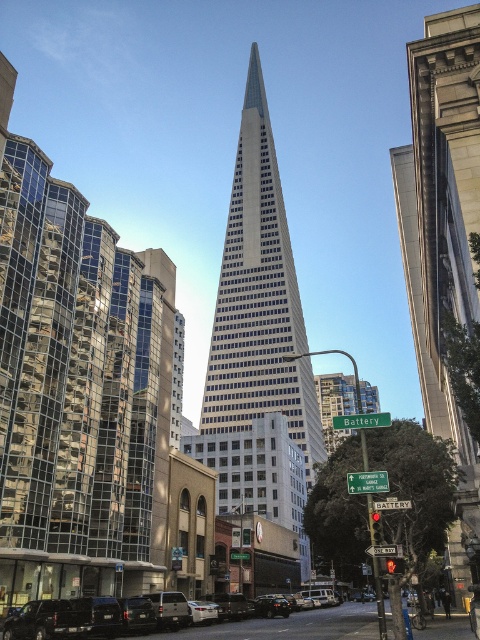
You are a delivery driver who needs to park your black matte suv at center in a parking spot near the gray stone building at right. However, the parking spot has a height restriction of 1.8 meters. Can you safely park your vehicle there?

The gray stone building at right is taller than the black matte suv at center. Since the suv is shorter than the building, it should be under the height restriction of 1.8 meters. Therefore, you can safely park the black matte suv at center in the parking spot.

You are a drone operator who needs to fly a drone from the black matte suv at center to the top of the glassy steel skyscraper at center. Given that the drone has a maximum flight height of 100 meters, can it reach the top of the skyscraper?

The glassy steel skyscraper at center is much taller than the black matte suv at center, so the drone may not be able to reach the top if the skyscraper exceeds the drone s 100 meter height limit. Check the actual height of the skyscraper before attempting the flight.

You are a delivery driver trying to navigate through the intersection. You see the gray stone building at right and the black matte suv at center. Which object is positioned higher in the image?

The gray stone building at right is located above the black matte suv at center in the image.